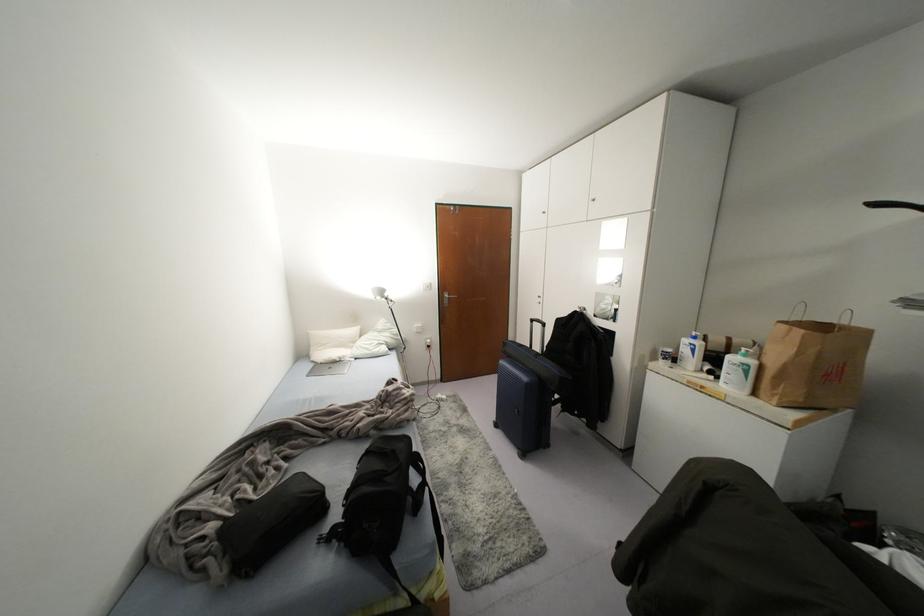
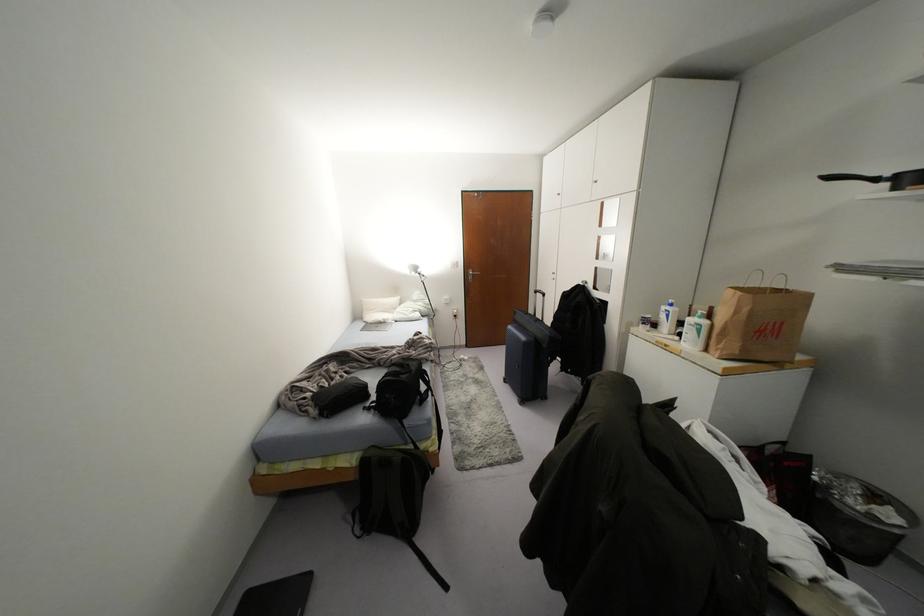
Find the pixel in the second image that matches pixel 691 350 in the first image.

(666, 315)